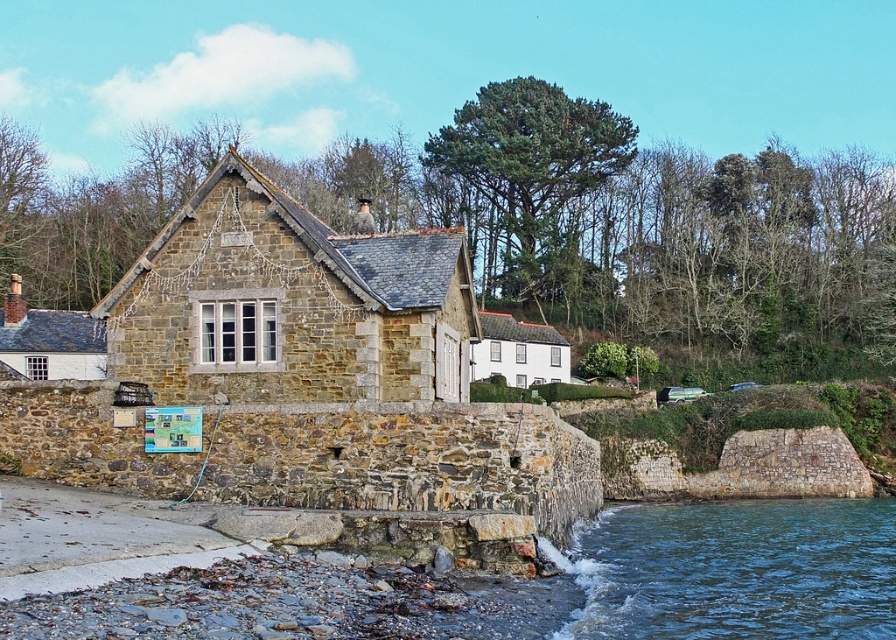
Question: In this image, where is stone cottage at center located relative to matte stone cottage at left?

Choices:
 (A) below
 (B) above

Answer: (B)

Question: Can you confirm if stone cottage at center is bigger than matte stone cottage at left?

Choices:
 (A) yes
 (B) no

Answer: (B)

Question: Which of the following is the closest to the observer?

Choices:
 (A) coord(569,570)
 (B) coord(350,332)

Answer: (A)

Question: Which point is closer to the camera?

Choices:
 (A) (468, 262)
 (B) (504, 369)

Answer: (A)

Question: Considering the relative positions of matte stone cottage at left and white painted wood cottage at center in the image provided, where is matte stone cottage at left located with respect to white painted wood cottage at center?

Choices:
 (A) below
 (B) above

Answer: (B)

Question: Which point appears farthest from the camera in this image?

Choices:
 (A) (488, 316)
 (B) (355, 253)

Answer: (A)